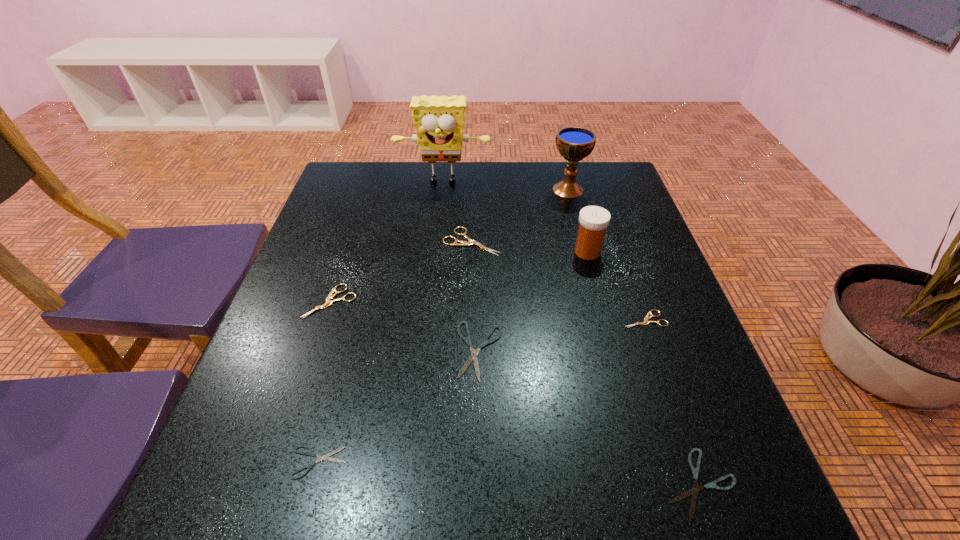
At what (x,y) coordinates should I click in order to perform the action: click on free region located on the right of the second tallest shears. Please return your answer as a coordinate pair (x, y). The image size is (960, 540). Looking at the image, I should click on (443, 301).

Identify the location of vacant region located on the back of the second black shears from right to left. The height and width of the screenshot is (540, 960). (480, 232).

In order to click on vacant space located on the front of the smallest beige shears in this screenshot , I will do `click(707, 498)`.

The height and width of the screenshot is (540, 960). Identify the location of vacant area located on the left of the rightmost black shears. (540, 483).

I want to click on vacant region located on the back of the leftmost black shears, so click(x=365, y=284).

At what (x,y) coordinates should I click in order to perform the action: click on sponge present at the far edge. Please return your answer as a coordinate pair (x, y). Looking at the image, I should click on (439, 121).

At what (x,y) coordinates should I click in order to perform the action: click on chalice located in the far edge section of the desktop. Please return your answer as a coordinate pair (x, y). The width and height of the screenshot is (960, 540). Looking at the image, I should click on (574, 143).

Locate an element on the screen. The height and width of the screenshot is (540, 960). chalice present at the right edge is located at coordinates (574, 143).

What are the coordinates of `medicine that is at the right edge` in the screenshot? It's located at (593, 220).

I want to click on object at the near left corner, so click(x=311, y=453).